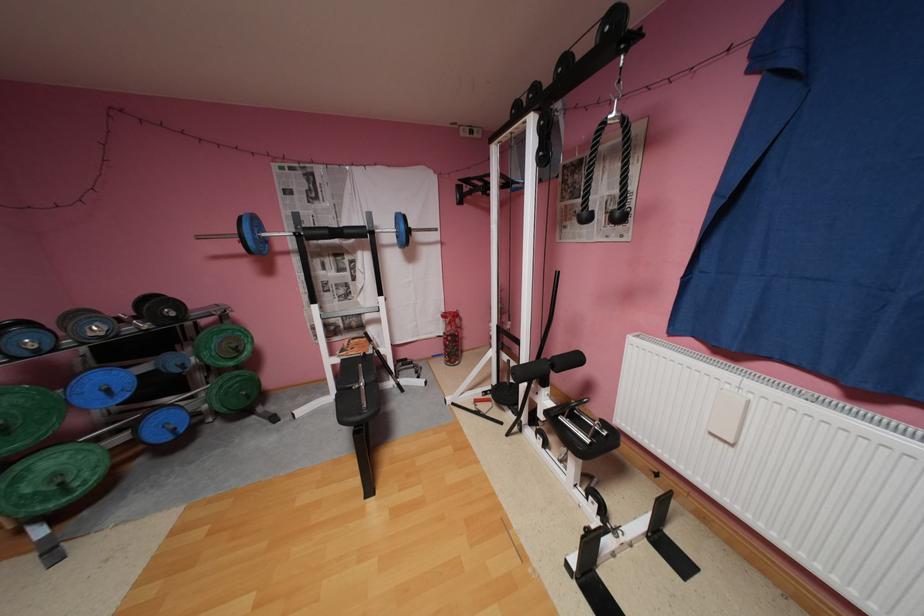
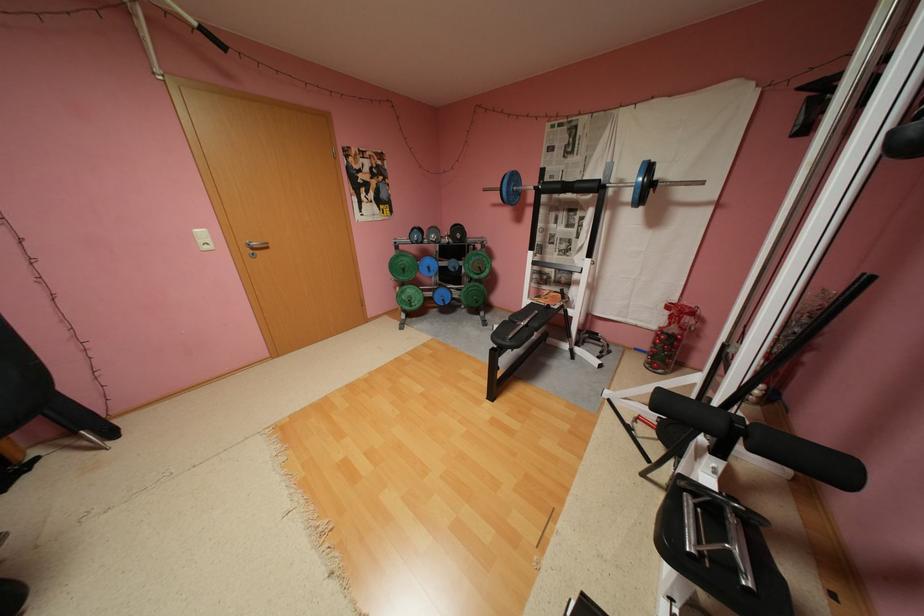
Locate, in the second image, the point that corresponds to (355,231) in the first image.

(586, 185)